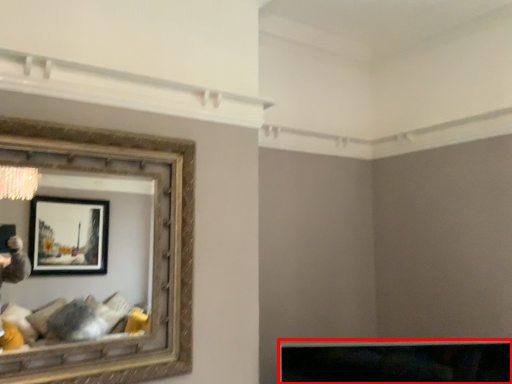
Question: From the image's perspective, what is the correct spatial relationship of furniture (annotated by the red box) in relation to picture frame?

Choices:
 (A) below
 (B) above

Answer: (A)